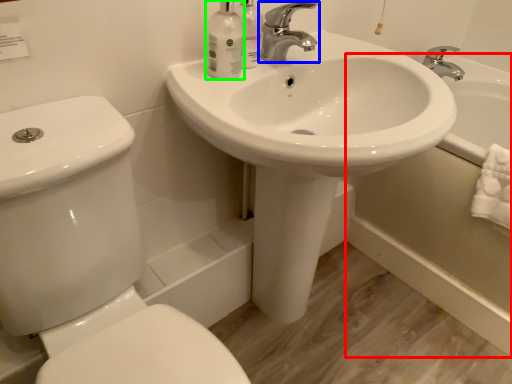
Question: Which is farther away from bath (highlighted by a red box)? tap (highlighted by a blue box) or mouthwash (highlighted by a green box)?

Choices:
 (A) tap
 (B) mouthwash

Answer: (B)